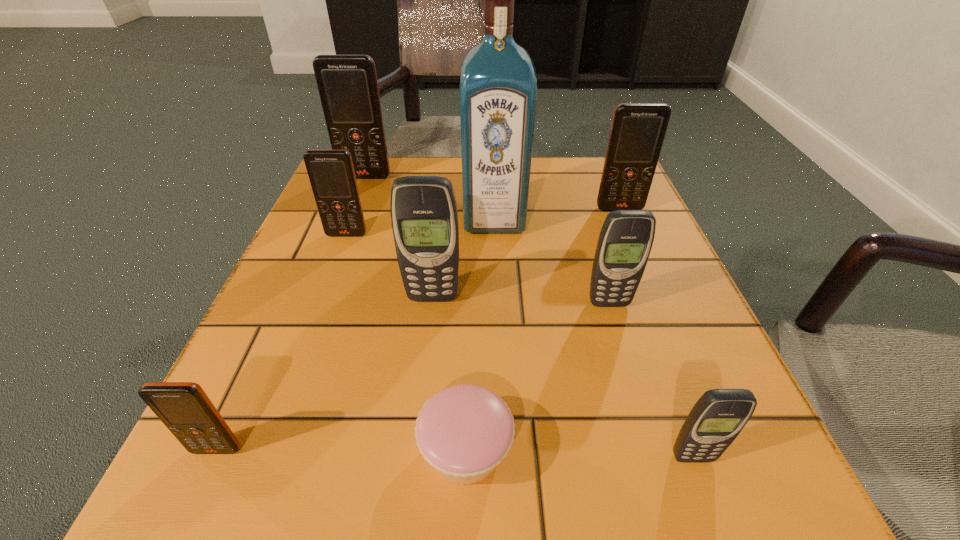
You are a GUI agent. You are given a task and a screenshot of the screen. Output one action in this format:
    pyautogui.click(x=<x>, y=<y>)
    Task: Click on the unoccupied position between the cupcake and the blue liquor
    The height and width of the screenshot is (540, 960).
    Given the screenshot: What is the action you would take?
    pyautogui.click(x=480, y=334)

Find the location of a particular element. The width and height of the screenshot is (960, 540). unoccupied area between the nearest gray cellular telephone and the biggest gray cellular telephone is located at coordinates point(563,377).

The height and width of the screenshot is (540, 960). Identify the location of unoccupied position between the farthest cellular telephone and the second smallest gray cellular telephone. (487, 240).

Find the location of a particular element. The width and height of the screenshot is (960, 540). vacant space in between the tallest object and the smallest gray cellular telephone is located at coordinates 593,338.

The width and height of the screenshot is (960, 540). I want to click on object that is the eighth closest one to the biggest gray cellular telephone, so click(347, 84).

Identify which object is located as the fourth nearest to the second tallest object. Please provide its 2D coordinates. Your answer should be formatted as a tuple, i.e. [(x, y)], where the tuple contains the x and y coordinates of a point satisfying the conditions above.

[(638, 130)]

The height and width of the screenshot is (540, 960). Identify the location of cellular telephone that is the fifth closest one to the blue liquor. (347, 84).

At what (x,y) coordinates should I click in order to perform the action: click on the fourth closest cellular telephone to the smallest gray cellular telephone. Please return your answer as a coordinate pair (x, y). Looking at the image, I should click on (638, 130).

Find the location of a particular element. Image resolution: width=960 pixels, height=540 pixels. orange cellular telephone that stands as the second closest to the nearest orange cellular telephone is located at coordinates (347, 84).

Select which orange cellular telephone appears as the fourth closest to the smallest gray cellular telephone. Please provide its 2D coordinates. Your answer should be formatted as a tuple, i.e. [(x, y)], where the tuple contains the x and y coordinates of a point satisfying the conditions above.

[(347, 84)]